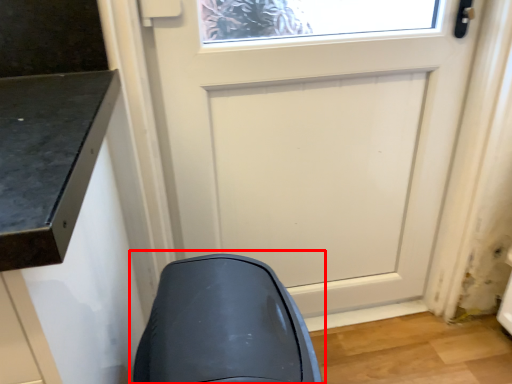
Question: In this image, where is swivel chair (annotated by the red box) located relative to door?

Choices:
 (A) right
 (B) left

Answer: (B)